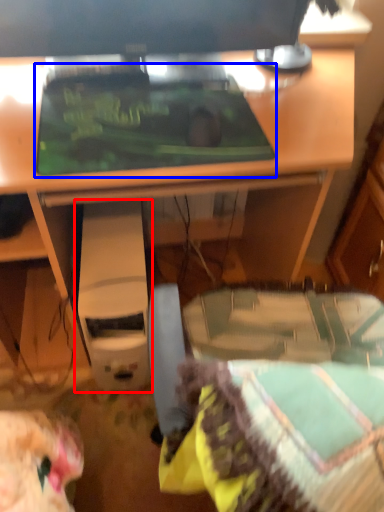
Question: Which of the following is the farthest to the observer, computer (highlighted by a red box) or crt screen (highlighted by a blue box)?

Choices:
 (A) computer
 (B) crt screen

Answer: (A)